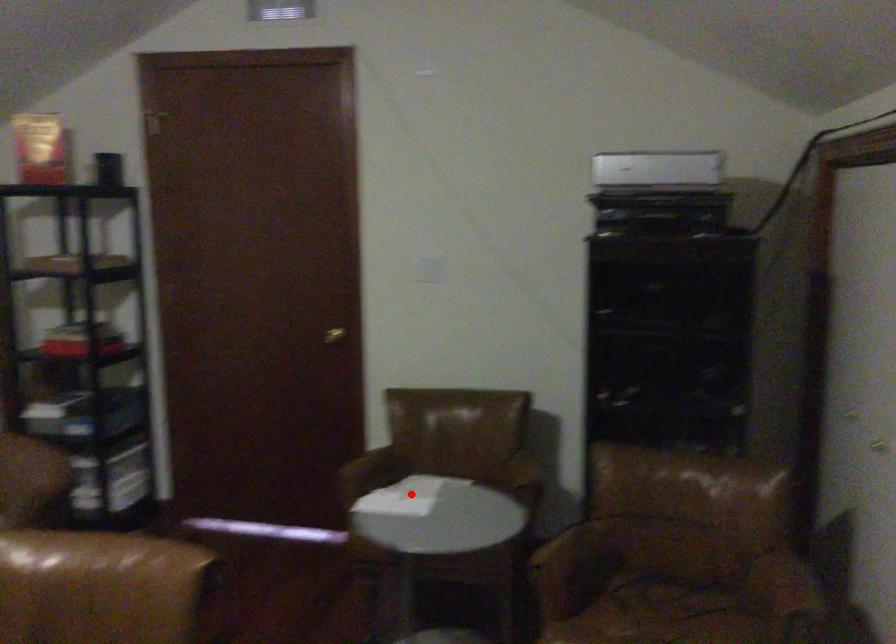
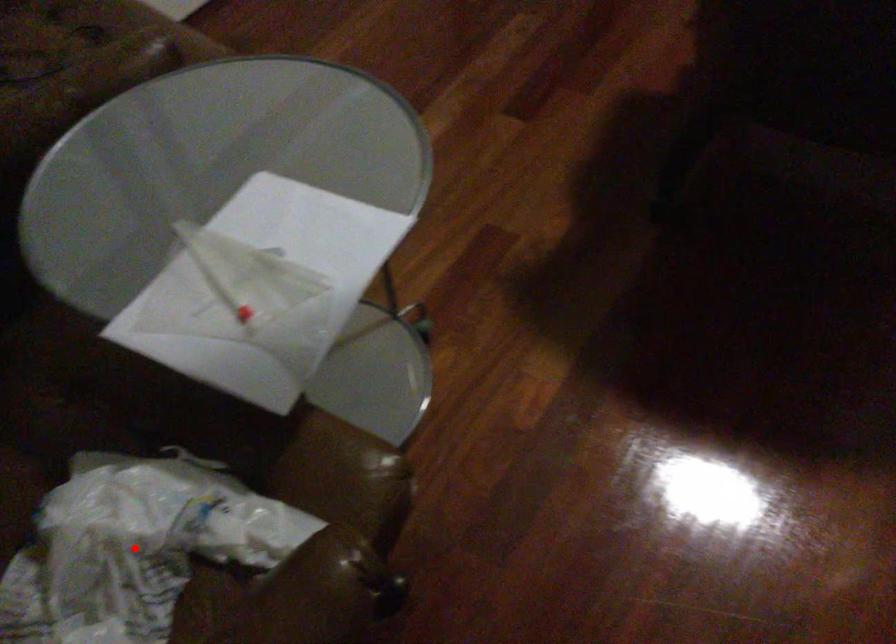
I am providing you with two images of the same scene from different viewpoints. A red point is marked on the first image and another point is marked on the second image. Are the points marked in image1 and image2 representing the same 3D position?

Yes